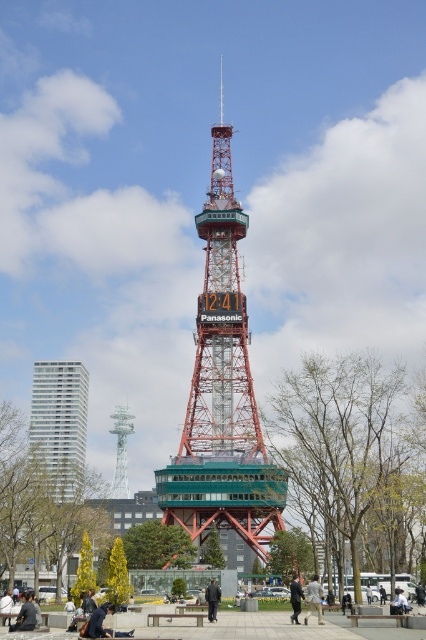
Question: Can you confirm if dark gray fabric jacket at center is positioned above wooden park bench at center?

Choices:
 (A) yes
 (B) no

Answer: (A)

Question: Which object is positioned closest to the concrete bench at center?

Choices:
 (A) wooden park bench at center
 (B) light gray fabric jacket at center

Answer: (B)

Question: Is dark gray fabric jacket at center smaller than concrete bench at center?

Choices:
 (A) no
 (B) yes

Answer: (B)

Question: Does white glass building at left have a lesser width compared to light gray fabric jacket at center?

Choices:
 (A) no
 (B) yes

Answer: (A)

Question: Which of the following is the closest to the observer?

Choices:
 (A) dark blue fabric jacket at lower left
 (B) dark blue jeans at lower left
 (C) light gray fabric jacket at center

Answer: (A)

Question: Which is nearer to the light gray fabric jacket at center?

Choices:
 (A) dark gray fabric jacket at lower center
 (B) dark gray fabric jacket at center
 (C) dark blue jeans at lower left

Answer: (A)